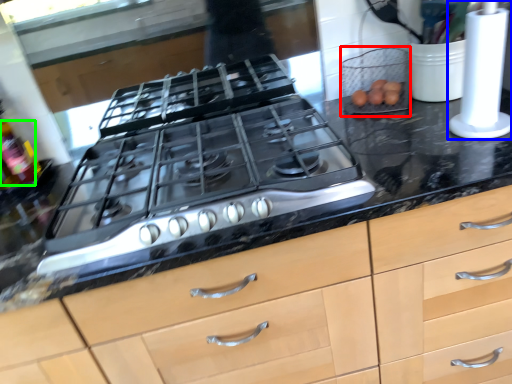
Question: Estimate the real-world distances between objects in this image. Which object is farther from appliance (highlighted by a red box), kitchen appliance (highlighted by a blue box) or bottle (highlighted by a green box)?

Choices:
 (A) kitchen appliance
 (B) bottle

Answer: (B)